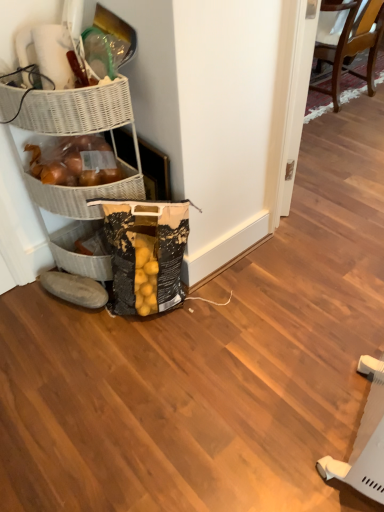
Find the location of a particular element. Image resolution: width=384 pixels, height=512 pixels. vacant space positioned to the left of black textured grocery bag at lower left is located at coordinates (79, 334).